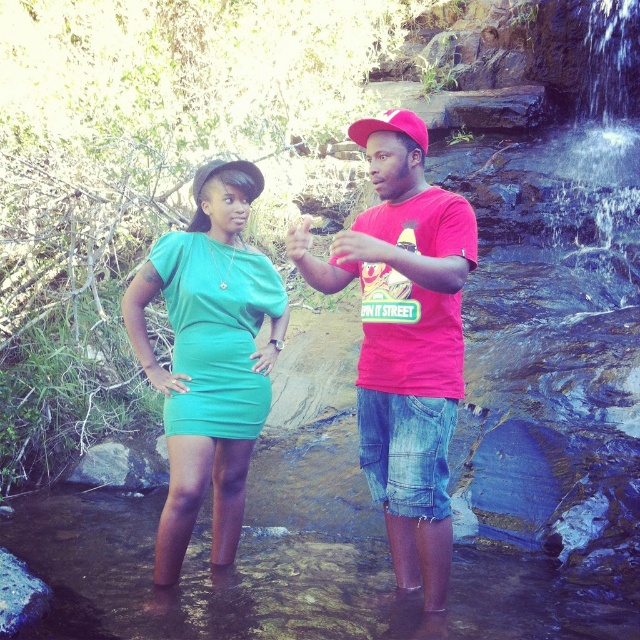
Question: Which point is closer to the camera?

Choices:
 (A) (184, 413)
 (B) (380, 323)

Answer: (B)

Question: Is matte red t-shirt at center above pink fabric baseball cap at center?

Choices:
 (A) no
 (B) yes

Answer: (A)

Question: Which of the following is the farthest from the observer?

Choices:
 (A) matte red t-shirt at center
 (B) pink fabric baseball cap at center

Answer: (B)

Question: Observing the image, what is the correct spatial positioning of matte red t-shirt at center in reference to pink fabric baseball cap at center?

Choices:
 (A) left
 (B) right

Answer: (B)

Question: Is matte red t-shirt at center further to camera compared to pink fabric baseball cap at center?

Choices:
 (A) yes
 (B) no

Answer: (B)

Question: Which of the following is the farthest from the observer?

Choices:
 (A) matte red t-shirt at center
 (B) matte green dress at center
 (C) pink fabric baseball cap at center

Answer: (B)